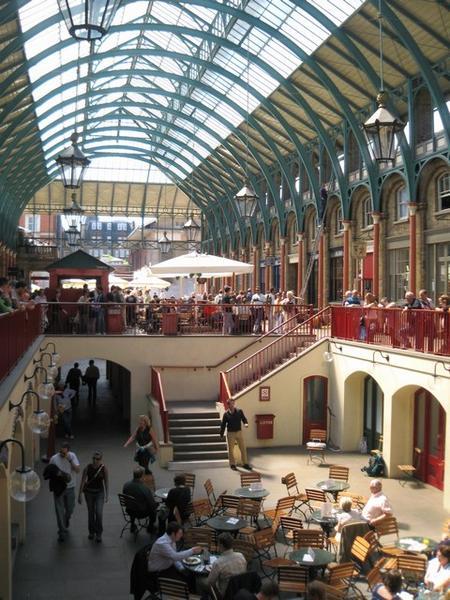
What are the coordinates of `wall lights` in the screenshot? It's located at (30, 482), (39, 422), (48, 388), (51, 372), (56, 358), (330, 354), (373, 365), (435, 383).